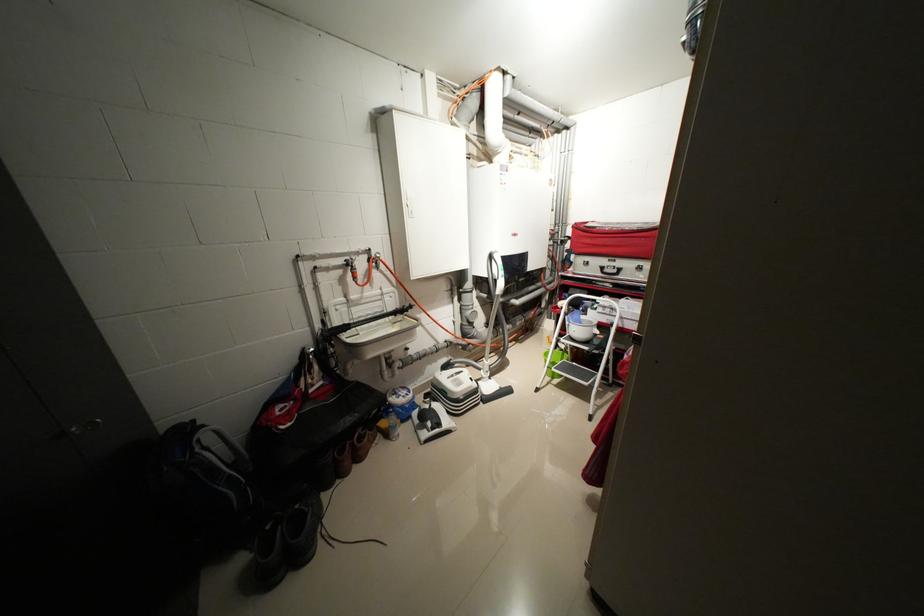
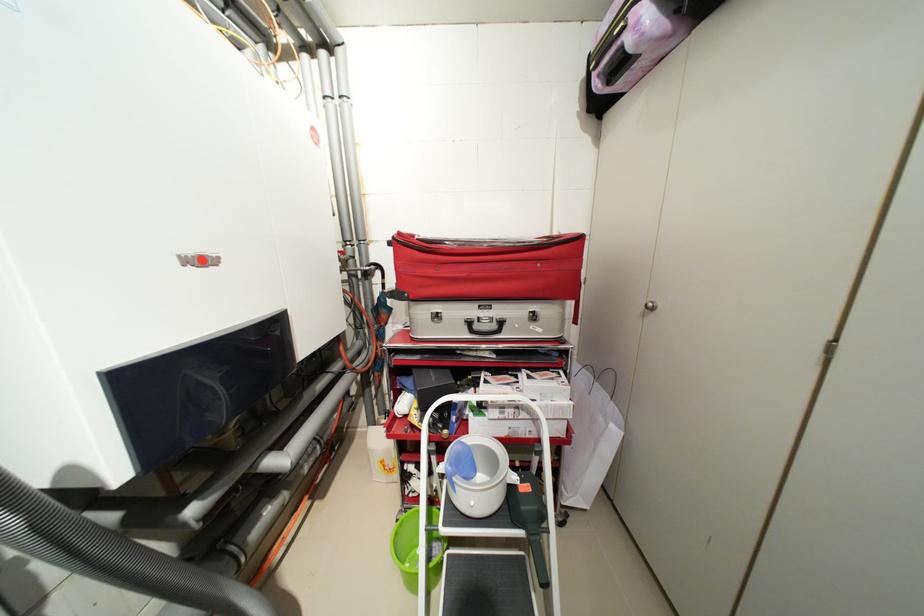
Question: I am providing you with two images of the same scene from different viewpoints. After the viewpoint changes to image2, which objects are now occluded?

Choices:
 (A) black fabric handle
 (B) black ladder step
 (C) white ladder handle
 (D) none of these

Answer: (D)